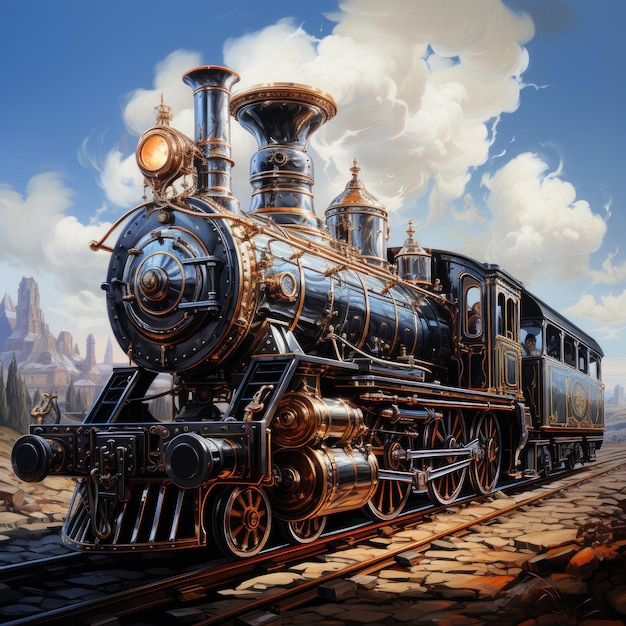
Where is `light`? The width and height of the screenshot is (626, 626). light is located at coordinates (153, 155).